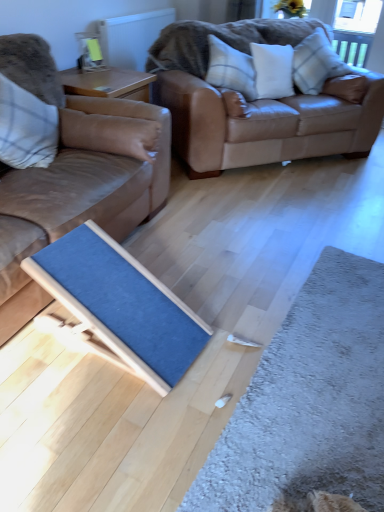
Find the location of a particular element. vacant space behind blue fabric doormat at center, which is the first doormat from left to right is located at coordinates (183, 263).